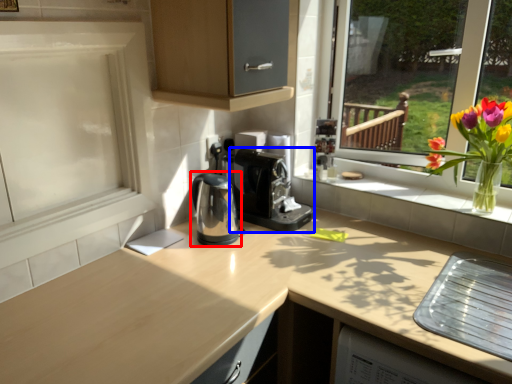
Question: Which object is closer to the camera taking this photo, coffeepot (highlighted by a red box) or coffee machine (highlighted by a blue box)?

Choices:
 (A) coffeepot
 (B) coffee machine

Answer: (A)